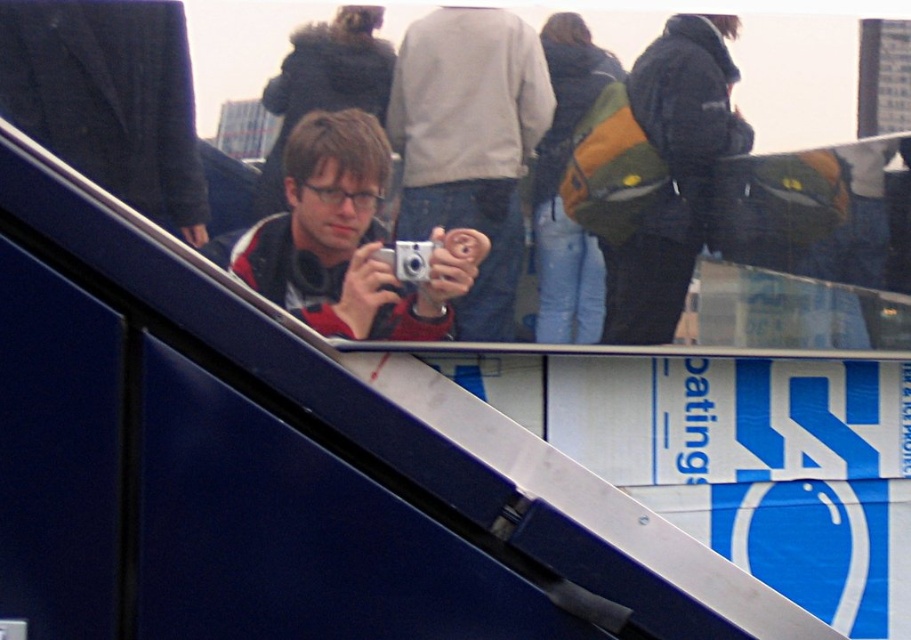
You are a photographer holding the camera and need to ensure the dark blue jacket at upper right is in focus. What is the minimum distance you should set your camera lens to achieve this?

The dark blue jacket at upper right is 1.99 meters from the camera, so you should set the camera lens to at least 1.99 meters to ensure it is in focus.